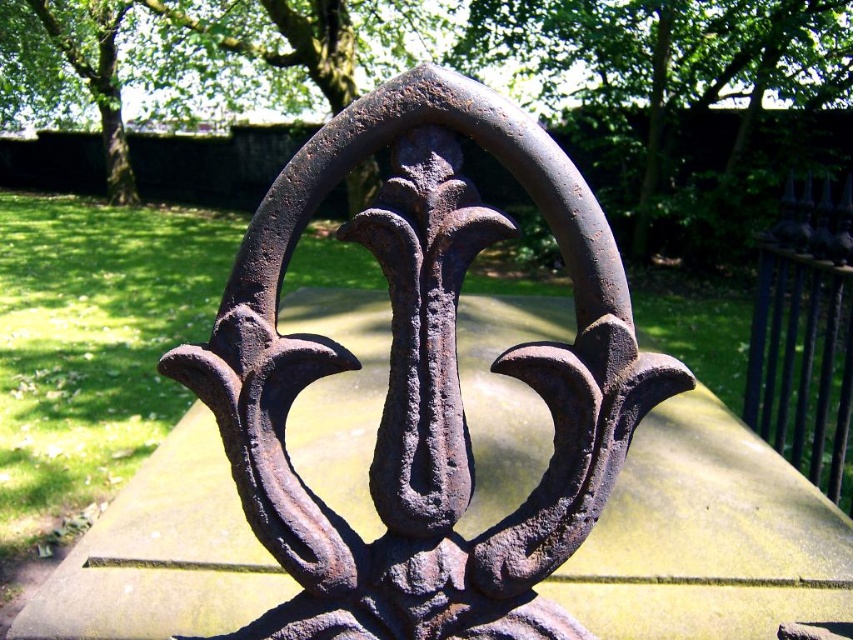
Question: Among these objects, which one is farthest from the camera?

Choices:
 (A) rusty metal sculpture at center
 (B) glossy black fence at upper right

Answer: (B)

Question: Which point appears farthest from the camera in this image?

Choices:
 (A) (849, 312)
 (B) (437, 378)

Answer: (A)

Question: Can you confirm if rusty metal sculpture at center is thinner than glossy black fence at upper right?

Choices:
 (A) no
 (B) yes

Answer: (A)

Question: Where is rusty metal sculpture at center located in relation to glossy black fence at upper right in the image?

Choices:
 (A) right
 (B) left

Answer: (B)

Question: Can you confirm if rusty metal sculpture at center is bigger than glossy black fence at upper right?

Choices:
 (A) yes
 (B) no

Answer: (B)